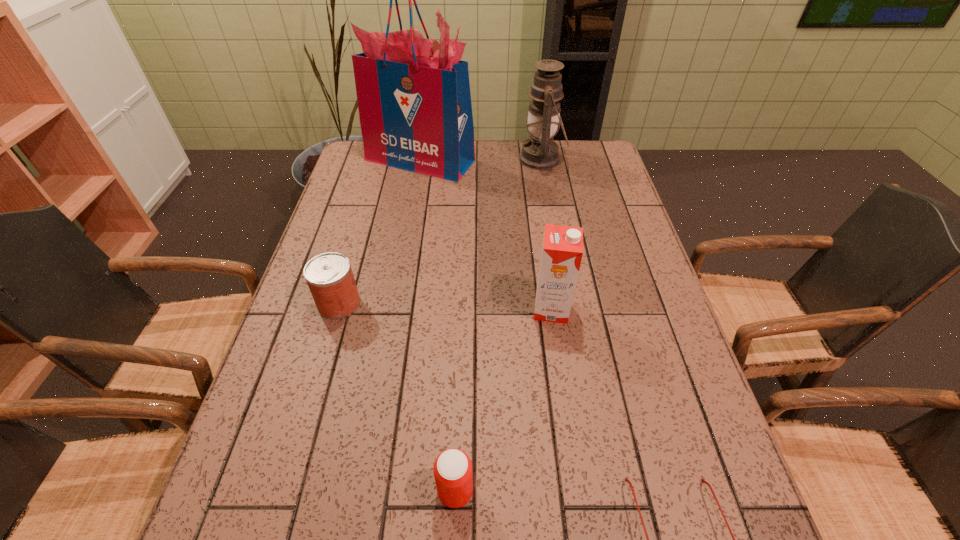
Locate an element on the screen. the tallest object is located at coordinates (414, 101).

Find the location of a particular element. oil lamp is located at coordinates (540, 152).

Find the location of a particular element. The height and width of the screenshot is (540, 960). the third tallest object is located at coordinates (562, 250).

Image resolution: width=960 pixels, height=540 pixels. Identify the location of can. (329, 276).

Identify the location of beer can. Image resolution: width=960 pixels, height=540 pixels. (453, 474).

Image resolution: width=960 pixels, height=540 pixels. Find the location of `vacant space located 0.140m on the front-facing side of the tallest object`. vacant space located 0.140m on the front-facing side of the tallest object is located at coordinates (411, 208).

What are the coordinates of `free space located 0.110m on the left of the second tallest object` in the screenshot? It's located at (488, 159).

At what (x,y) coordinates should I click in order to perform the action: click on vacant position located on the right of the third tallest object. Please return your answer as a coordinate pair (x, y). Looking at the image, I should click on (664, 309).

Identify the location of blank space located on the back of the can. This screenshot has height=540, width=960. (363, 222).

This screenshot has height=540, width=960. I want to click on free space located on the left of the beer can, so click(x=353, y=491).